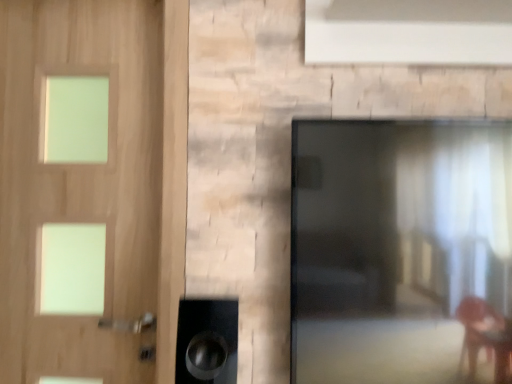
Question: Should I look upward or downward to see black glossy screen door at right?

Choices:
 (A) up
 (B) down

Answer: (B)

Question: Should I look upward or downward to see light wood door at left?

Choices:
 (A) up
 (B) down

Answer: (A)

Question: Is light wood door at left shorter than black glossy screen door at right?

Choices:
 (A) no
 (B) yes

Answer: (A)

Question: From the image's perspective, is light wood door at left on top of black glossy screen door at right?

Choices:
 (A) no
 (B) yes

Answer: (B)

Question: Does light wood door at left have a smaller size compared to black glossy screen door at right?

Choices:
 (A) no
 (B) yes

Answer: (A)

Question: Is light wood door at left thinner than black glossy screen door at right?

Choices:
 (A) no
 (B) yes

Answer: (B)

Question: Is light wood door at left positioned with its back to black glossy screen door at right?

Choices:
 (A) yes
 (B) no

Answer: (B)

Question: Is the position of light wood door at left less distant than that of black glossy screen door at right?

Choices:
 (A) yes
 (B) no

Answer: (B)

Question: Is there a large distance between black glossy screen door at right and light wood door at left?

Choices:
 (A) no
 (B) yes

Answer: (A)

Question: Does black glossy screen door at right turn towards light wood door at left?

Choices:
 (A) yes
 (B) no

Answer: (B)

Question: Is black glossy screen door at right facing away from light wood door at left?

Choices:
 (A) no
 (B) yes

Answer: (A)

Question: Is black glossy screen door at right thinner than light wood door at left?

Choices:
 (A) no
 (B) yes

Answer: (A)

Question: Does black glossy screen door at right have a larger size compared to light wood door at left?

Choices:
 (A) yes
 (B) no

Answer: (B)

Question: Is light wood door at left completely or partially inside black glossy screen door at right?

Choices:
 (A) no
 (B) yes

Answer: (A)

Question: Looking at the image, does black glossy screen door at right seem bigger or smaller compared to light wood door at left?

Choices:
 (A) small
 (B) big

Answer: (A)